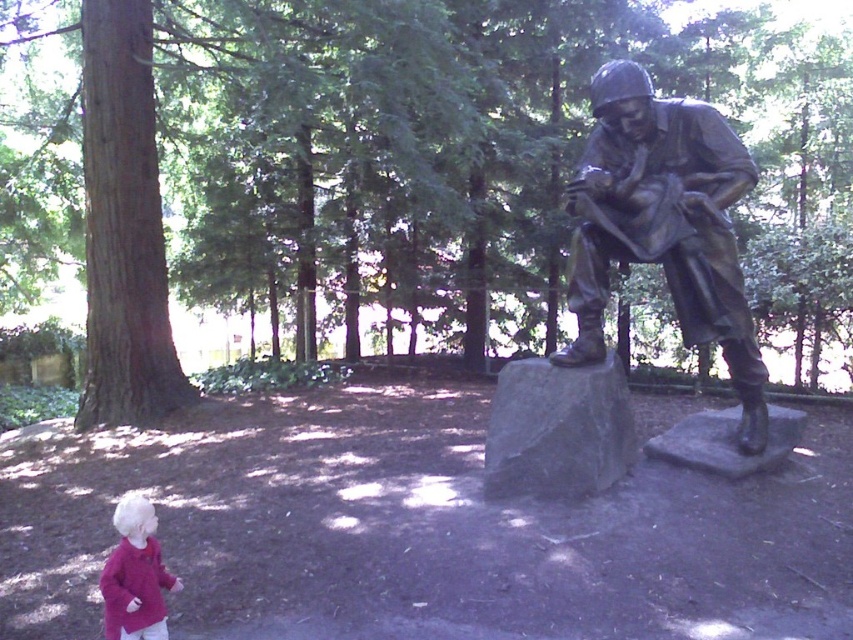
Question: Is bronze statue at right above gray stone at center?

Choices:
 (A) no
 (B) yes

Answer: (B)

Question: Among these objects, which one is farthest from the camera?

Choices:
 (A) matte pink sweater at lower left
 (B) bronze statue at right

Answer: (B)

Question: Where is bronze statue at right located in relation to gray stone at center in the image?

Choices:
 (A) below
 (B) above

Answer: (B)

Question: Does gray stone at center have a lesser width compared to matte pink sweater at lower left?

Choices:
 (A) yes
 (B) no

Answer: (B)

Question: Estimate the real-world distances between objects in this image. Which object is farther from the bronze statue at right?

Choices:
 (A) matte pink sweater at lower left
 (B) gray stone at center

Answer: (A)

Question: Among these points, which one is farthest from the camera?

Choices:
 (A) (747, 416)
 (B) (131, 630)
 (C) (624, 417)

Answer: (A)